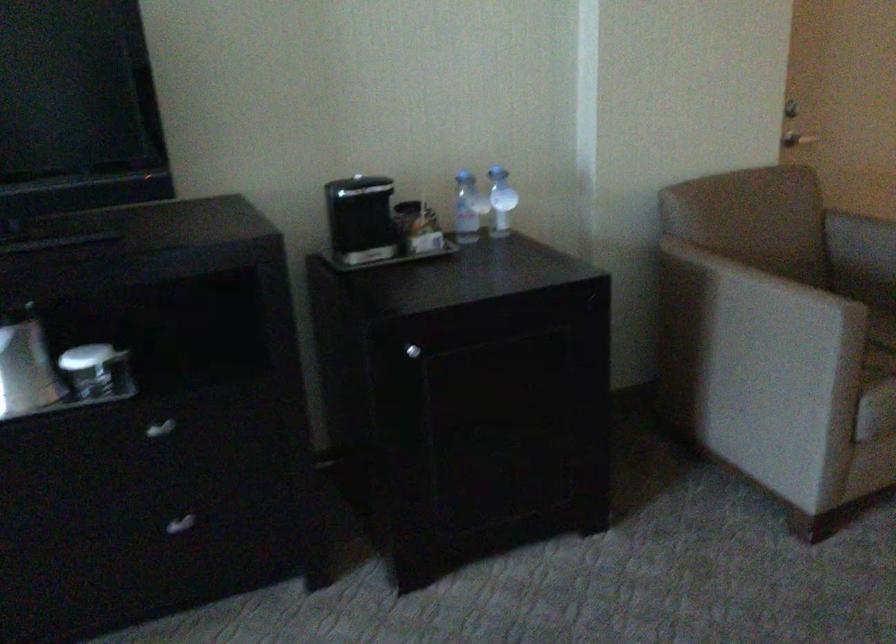
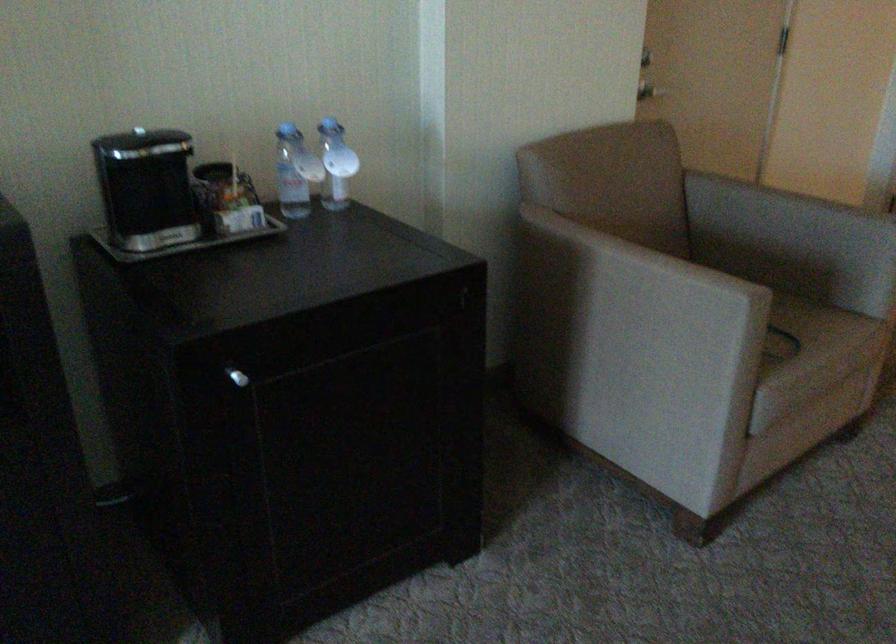
The point at [502,200] is marked in the first image. Where is the corresponding point in the second image?

(336, 164)